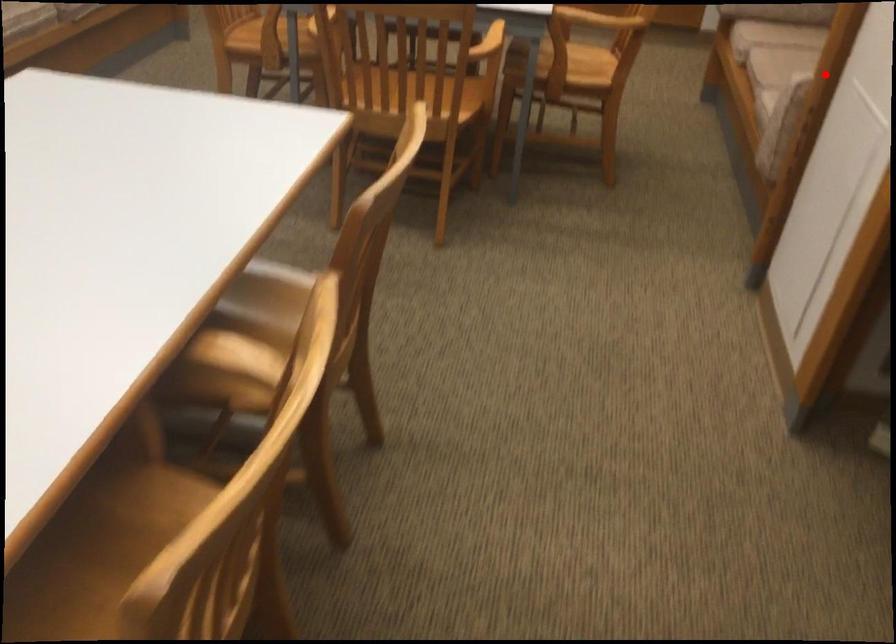
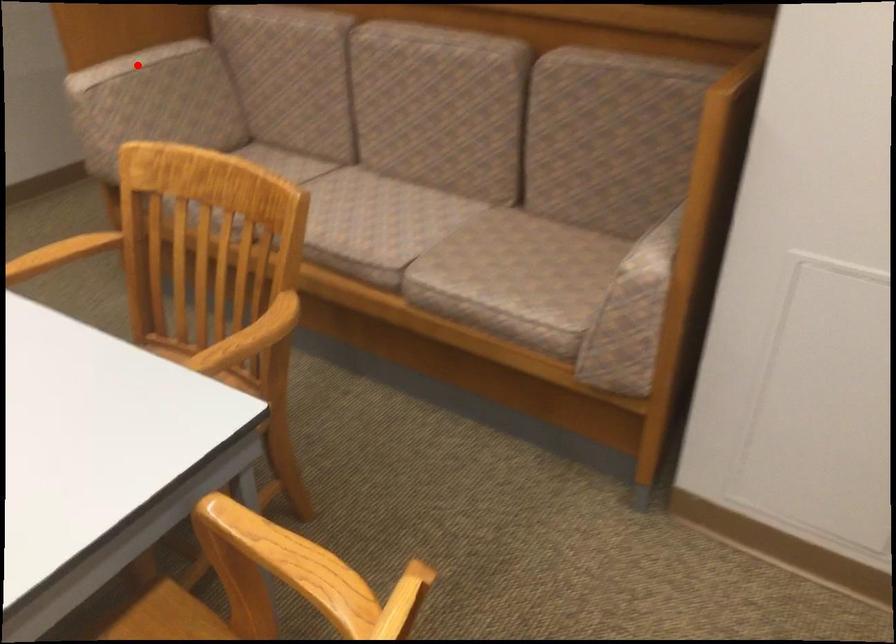
I am providing you with two images of the same scene from different viewpoints. A red point is marked on the first image and another point is marked on the second image. Do the highlighted points in image1 and image2 indicate the same real-world spot?

No